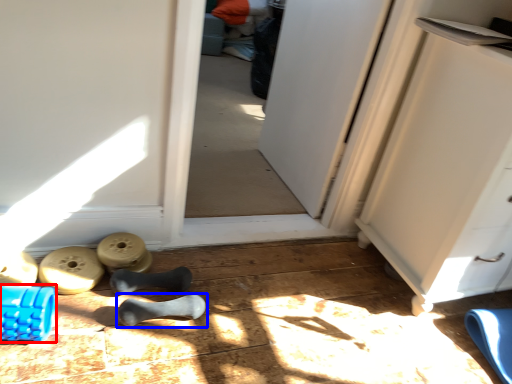
Question: Which of the following is the farthest to the observer, job (highlighted by a red box) or footwear (highlighted by a blue box)?

Choices:
 (A) job
 (B) footwear

Answer: (B)